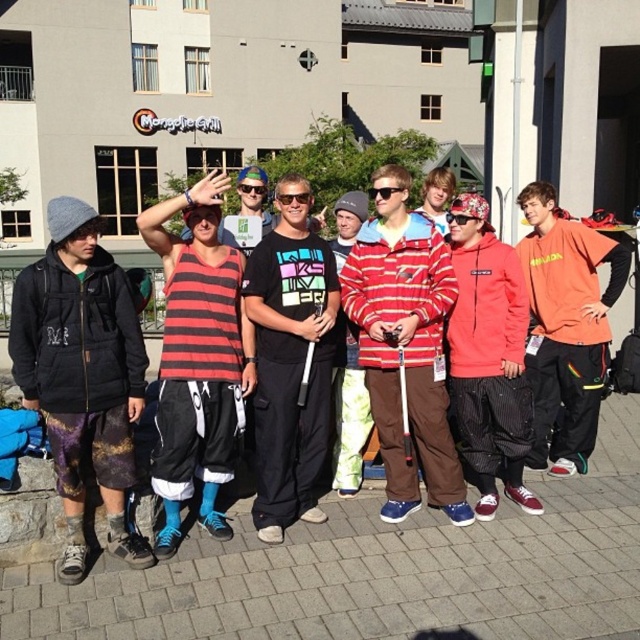
Question: Does black fleece jacket at left come behind matte black goggles at center?

Choices:
 (A) yes
 (B) no

Answer: (B)

Question: Can you confirm if striped tank top at center is thinner than black plastic sunglasses at center?

Choices:
 (A) no
 (B) yes

Answer: (A)

Question: Is the position of black plastic sunglasses at center less distant than that of brushed metal goggles at center?

Choices:
 (A) no
 (B) yes

Answer: (B)

Question: Estimate the real-world distances between objects in this image. Which object is farther from the matte black sunglasses at center?

Choices:
 (A) black plastic sunglasses at center
 (B) matte black goggles at center
 (C) black fleece jacket at left
 (D) striped cotton hoodie at center

Answer: (C)

Question: Which object appears closest to the camera in this image?

Choices:
 (A) matte black goggles at center
 (B) red fleece hoodie at center

Answer: (B)

Question: Which point is farther from the camera taking this photo?

Choices:
 (A) (460, 221)
 (B) (291, 401)
 (C) (412, 548)
 (D) (285, 202)

Answer: (A)